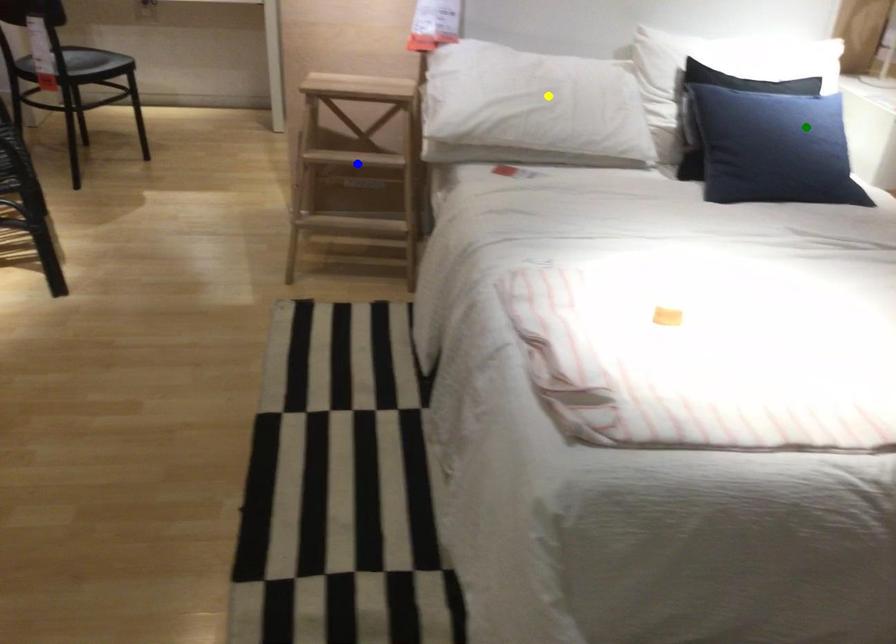
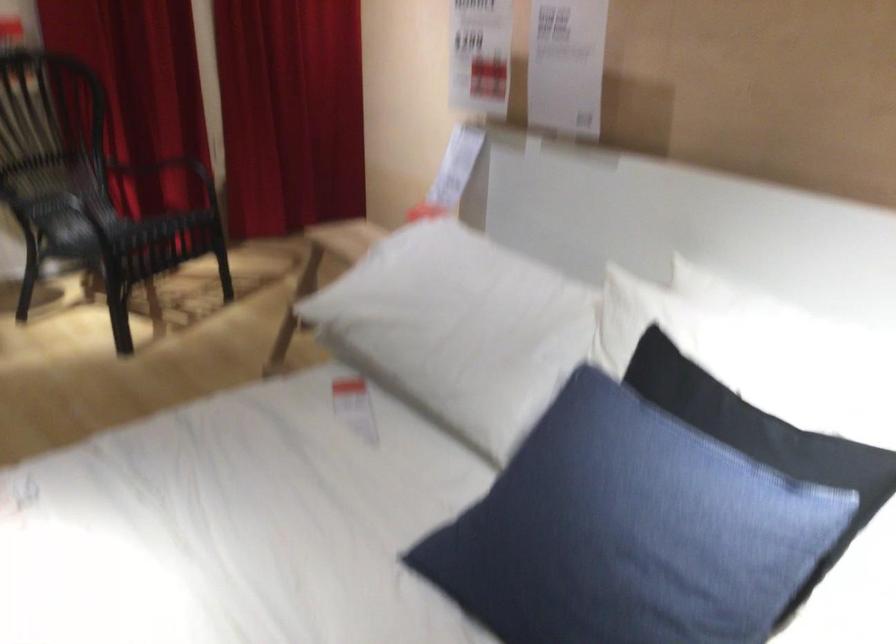
I am providing you with two images of the same scene from different viewpoints. Three points are marked in image1. Which point corresponds to a part or object that is occluded in image2?In image1, three points are marked. Which of them correspond to a part or object that is occluded in image2?Among the three points shown in image1, which one corresponds to a part or object that is no longer visible due to occlusion in image2?

blue point cannot be seen in image2.